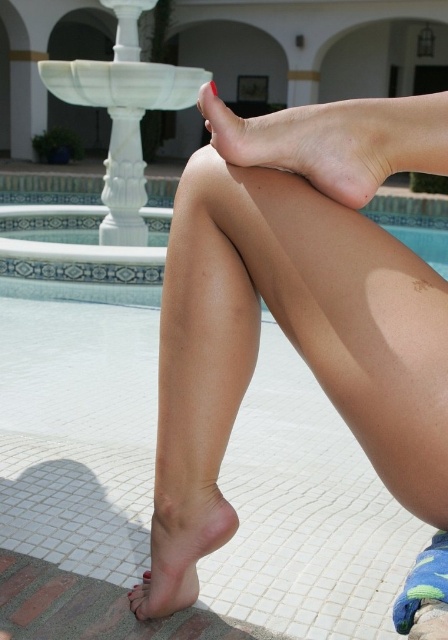
Between point (35, 294) and point (147, 573), which one is positioned in front?

Point (147, 573) is more forward.

Between point (73, 182) and point (143, 580), which one is positioned in front?

Point (143, 580)

Find the location of `blue tile swimming pool at center`. blue tile swimming pool at center is located at coordinates (81, 276).

Which is above, white marble fountain at left or matte pink toe at lower left?

white marble fountain at left is above.

Which is in front, point (133, 221) or point (147, 570)?

Point (147, 570) is in front.

This screenshot has width=448, height=640. Find the location of `white marble fountain at left`. white marble fountain at left is located at coordinates (124, 113).

Can you confirm if smooth skin legs at center is smaller than pink matte skin at lower center?

No, smooth skin legs at center is not smaller than pink matte skin at lower center.

Is the position of smooth skin legs at center more distant than that of pink matte skin at lower center?

No, it is not.

Who is more forward, (444, 310) or (189, 532)?

Point (444, 310) is in front.

Locate an element on the screen. smooth skin legs at center is located at coordinates (296, 310).